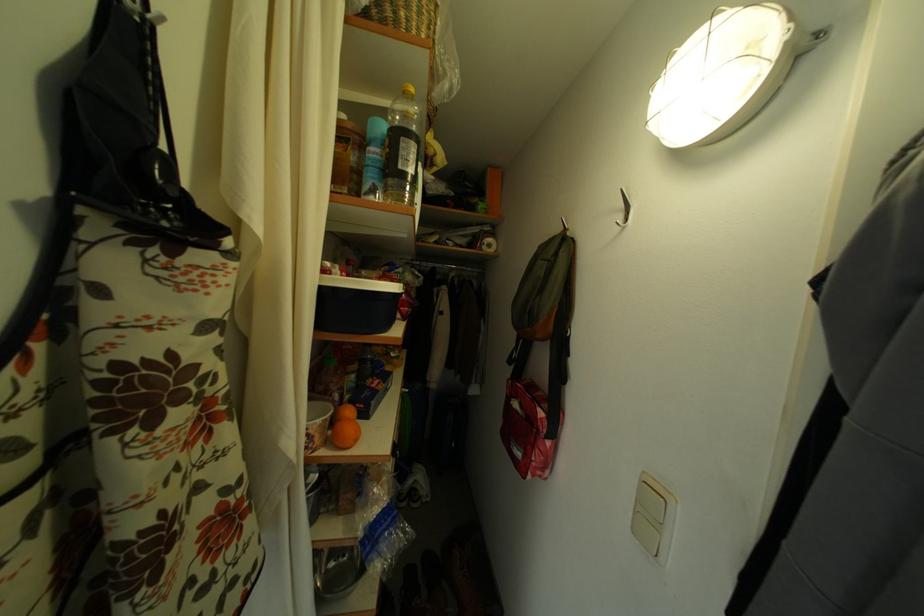
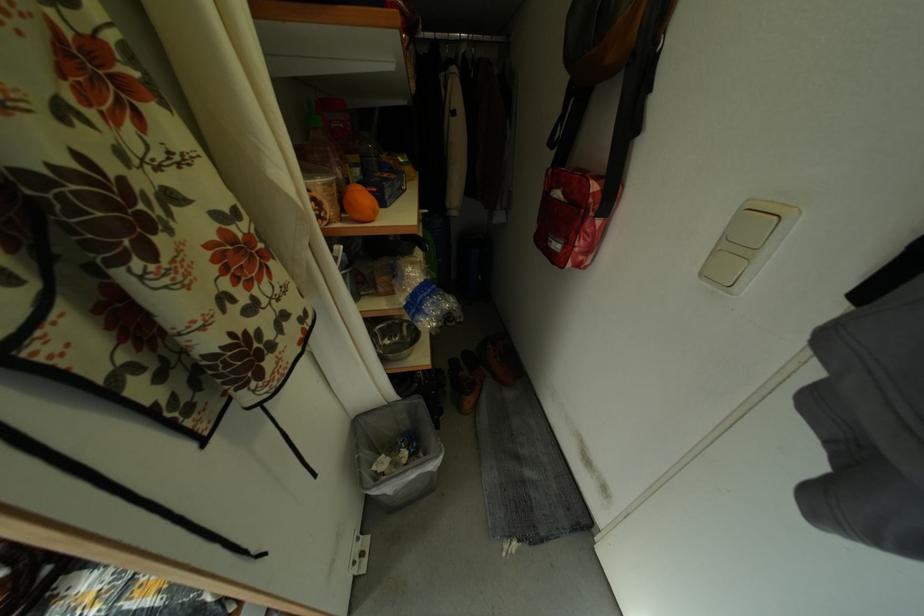
Find the pixel in the second image that matches the point at 541,467 in the first image.

(584, 253)